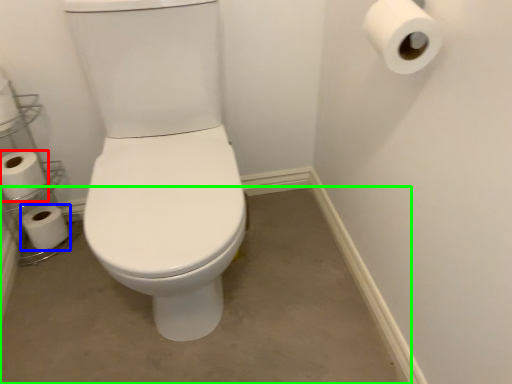
Question: Based on their relative distances, which object is farther from toilet paper (highlighted by a red box)? Choose from toilet paper (highlighted by a blue box) and concrete (highlighted by a green box).

Choices:
 (A) toilet paper
 (B) concrete

Answer: (B)